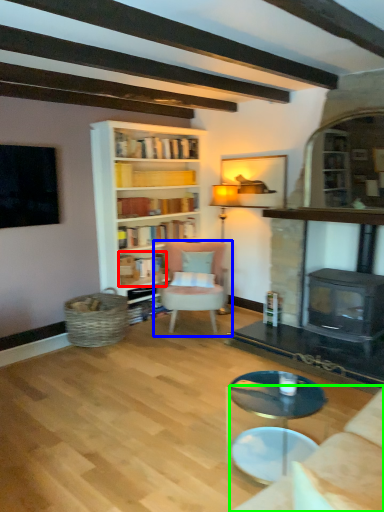
Question: Which is farther away from book (highlighted by a red box)? chair (highlighted by a blue box) or studio couch (highlighted by a green box)?

Choices:
 (A) chair
 (B) studio couch

Answer: (B)